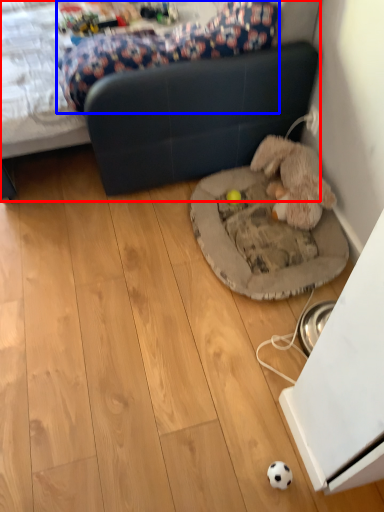
Question: Which object is closer to the camera taking this photo, studio couch (highlighted by a red box) or mattress (highlighted by a blue box)?

Choices:
 (A) studio couch
 (B) mattress

Answer: (A)